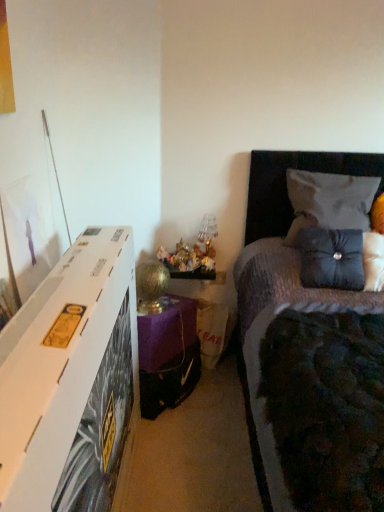
Question: Looking at their shapes, would you say velvet gray pillow at upper right, the second pillow positioned from the bottom, is wider or thinner than gold metallic table lamp at lower center?

Choices:
 (A) wide
 (B) thin

Answer: (A)

Question: From the image's perspective, is velvet gray pillow at upper right, placed as the 1th pillow when sorted from top to bottom, located above or below gold metallic table lamp at lower center?

Choices:
 (A) below
 (B) above

Answer: (B)

Question: Estimate the real-world distances between objects in this image. Which object is closer to the velvet gray pillow at upper right, placed as the 1th pillow when sorted from top to bottom?

Choices:
 (A) dark grey fabric bed at upper right
 (B) satin blue pillow at upper right, which is counted as the 2th pillow, starting from the top
 (C) gold metallic table lamp at lower center
 (D) purple fabric nightstand at lower center

Answer: (A)

Question: Estimate the real-world distances between objects in this image. Which object is closer to the satin blue pillow at upper right, which ranks as the first pillow in bottom-to-top order?

Choices:
 (A) gold metallic table lamp at lower center
 (B) dark grey fabric bed at upper right
 (C) purple fabric nightstand at lower center
 (D) velvet gray pillow at upper right, placed as the 1th pillow when sorted from top to bottom

Answer: (D)